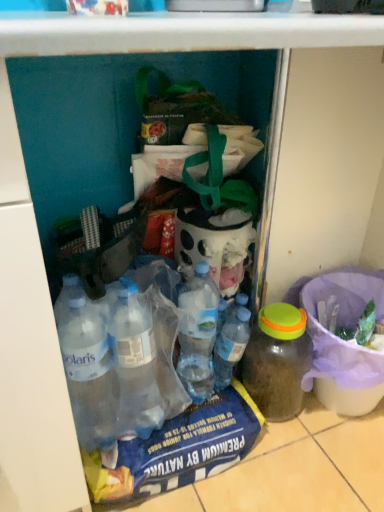
Question: From the image's perspective, is transparent plastic bottle at center, which appears as the second bottle when viewed from the right, under translucent plastic bucket at lower right?

Choices:
 (A) yes
 (B) no

Answer: (B)

Question: Does transparent plastic bottle at center, which appears as the second bottle when viewed from the right, have a greater width compared to translucent plastic bucket at lower right?

Choices:
 (A) no
 (B) yes

Answer: (A)

Question: Can you confirm if transparent plastic bottle at center, which appears as the second bottle when viewed from the right, is taller than translucent plastic bucket at lower right?

Choices:
 (A) yes
 (B) no

Answer: (B)

Question: Could you tell me if transparent plastic bottle at center, which is the first bottle from left to right, is facing translucent plastic bucket at lower right?

Choices:
 (A) no
 (B) yes

Answer: (A)

Question: Considering the relative positions of transparent plastic bottle at center, which appears as the second bottle when viewed from the right, and translucent plastic bucket at lower right in the image provided, is transparent plastic bottle at center, which appears as the second bottle when viewed from the right, in front of translucent plastic bucket at lower right?

Choices:
 (A) no
 (B) yes

Answer: (A)

Question: Is translucent plastic bucket at lower right bigger or smaller than transparent plastic bottle at center, which appears as the second bottle when viewed from the right?

Choices:
 (A) small
 (B) big

Answer: (B)

Question: Considering the positions of point (334, 402) and point (246, 327), is point (334, 402) closer or farther from the camera than point (246, 327)?

Choices:
 (A) closer
 (B) farther

Answer: (B)

Question: From the image's perspective, relative to transparent plastic bottle at center, which appears as the second bottle when viewed from the right, is translucent plastic bucket at lower right above or below?

Choices:
 (A) below
 (B) above

Answer: (A)

Question: In terms of height, does translucent plastic bucket at lower right look taller or shorter compared to transparent plastic bottle at center, which appears as the second bottle when viewed from the right?

Choices:
 (A) short
 (B) tall

Answer: (B)

Question: Is translucent plastic bucket at lower right wider or thinner than translucent plastic jar at lower right, arranged as the 2th bottle when viewed from the left?

Choices:
 (A) wide
 (B) thin

Answer: (A)

Question: From the image's perspective, is translucent plastic bucket at lower right positioned above or below translucent plastic jar at lower right, arranged as the 2th bottle when viewed from the left?

Choices:
 (A) above
 (B) below

Answer: (A)

Question: From a real-world perspective, is translucent plastic bucket at lower right positioned above or below translucent plastic jar at lower right, which appears as the 1th bottle when viewed from the right?

Choices:
 (A) below
 (B) above

Answer: (A)

Question: Is translucent plastic bucket at lower right inside the boundaries of translucent plastic jar at lower right, which appears as the 1th bottle when viewed from the right, or outside?

Choices:
 (A) inside
 (B) outside

Answer: (B)

Question: Is translucent plastic jar at lower right, which appears as the 1th bottle when viewed from the right, in front of or behind translucent plastic bucket at lower right in the image?

Choices:
 (A) front
 (B) behind

Answer: (B)

Question: From the image's perspective, is translucent plastic jar at lower right, arranged as the 2th bottle when viewed from the left, positioned above or below translucent plastic bucket at lower right?

Choices:
 (A) above
 (B) below

Answer: (B)